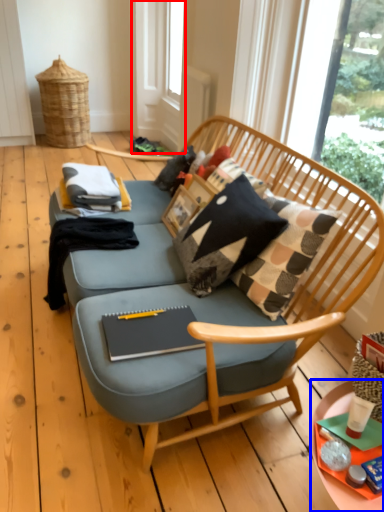
Question: Which object appears farthest to the camera in this image, screen door (highlighted by a red box) or desk (highlighted by a blue box)?

Choices:
 (A) screen door
 (B) desk

Answer: (A)